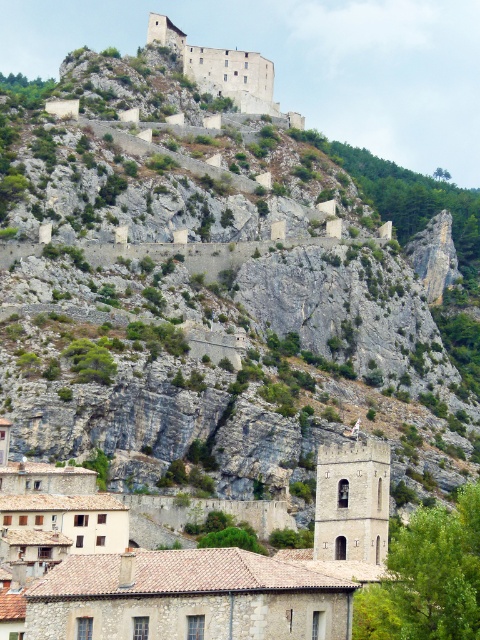
Is stone church at center to the left of brown stone castle at upper center from the viewer's perspective?

Correct, you'll find stone church at center to the left of brown stone castle at upper center.

The height and width of the screenshot is (640, 480). Describe the element at coordinates (229, 573) in the screenshot. I see `stone church at center` at that location.

Where is `stone church at center`? stone church at center is located at coordinates (229, 573).